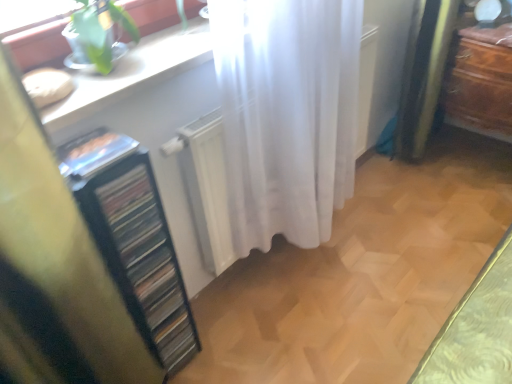
This screenshot has height=384, width=512. In order to click on vacant area situated below brown wooden dresser at right (from a real-world perspective) in this screenshot , I will do `click(461, 164)`.